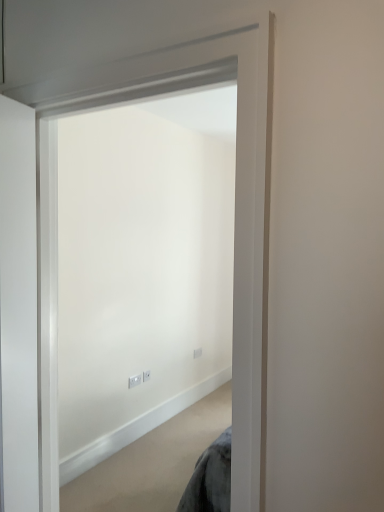
Question: Looking at the image, does white matte door at center seem bigger or smaller compared to white plastic electric outlet at center, the third electric outlet from the back?

Choices:
 (A) big
 (B) small

Answer: (A)

Question: Choose the correct answer: Is white matte door at center inside white plastic electric outlet at center, the third electric outlet viewed from the right, or outside it?

Choices:
 (A) outside
 (B) inside

Answer: (A)

Question: Which object is the closest to the white plastic electric outlet at center, the second electric outlet when ordered from back to front?

Choices:
 (A) white plastic electric outlet at center, the 3th electric outlet in the front-to-back sequence
 (B) white matte door at center
 (C) white plastic electric outlet at center, the third electric outlet viewed from the right

Answer: (C)

Question: Based on their relative distances, which object is nearer to the white plastic electric outlet at center, the first electric outlet from the back?

Choices:
 (A) white matte door at center
 (B) white plastic electric outlet at center, the 2th electric outlet from the left
 (C) white plastic electric outlet at center, the first electric outlet when ordered from front to back

Answer: (B)